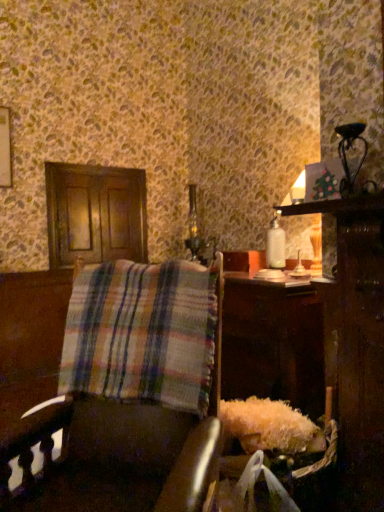
Where is `metallic silver table lamp at upper right`? Image resolution: width=384 pixels, height=512 pixels. metallic silver table lamp at upper right is located at coordinates (348, 150).

This screenshot has height=512, width=384. What do you see at coordinates (142, 334) in the screenshot?
I see `plaid fabric at left` at bounding box center [142, 334].

What is the approximate width of plaid fabric at left?

plaid fabric at left is 10.40 inches in width.

This screenshot has width=384, height=512. In order to click on metallic silver table lamp at upper right in this screenshot , I will do `click(348, 150)`.

From the image's perspective, is metallic silver table lamp at upper right under plaid fabric chair at center?

No, from the image's perspective, metallic silver table lamp at upper right is not beneath plaid fabric chair at center.

From a real-world perspective, relative to plaid fabric chair at center, is metallic silver table lamp at upper right vertically above or below?

Clearly, from a real-world perspective, metallic silver table lamp at upper right is above plaid fabric chair at center.

The image size is (384, 512). I want to click on table lamp behind the plaid fabric chair at center, so click(348, 150).

In the scene shown: Does metallic silver table lamp at upper right turn towards plaid fabric chair at center?

No, metallic silver table lamp at upper right is not facing towards plaid fabric chair at center.

Between plaid fabric at left and metallic silver table lamp at upper right, which one appears on the left side from the viewer's perspective?

plaid fabric at left.

Can you tell me how much plaid fabric at left and metallic silver table lamp at upper right differ in facing direction?

There is a 43.5-degree angle between the facing directions of plaid fabric at left and metallic silver table lamp at upper right.

Does point (129, 338) appear closer or farther from the camera than point (346, 154)?

Clearly, point (129, 338) is closer to the camera than point (346, 154).

Does plaid fabric at left lie behind metallic silver table lamp at upper right?

No.

Looking at this image, considering the relative positions of plaid fabric chair at center and metallic silver table lamp at upper right in the image provided, is plaid fabric chair at center behind metallic silver table lamp at upper right?

That is False.

Considering the points (137, 372) and (360, 161), which point is behind, point (137, 372) or point (360, 161)?

The point (360, 161) is farther from the camera.

From the image's perspective, is plaid fabric chair at center located beneath metallic silver table lamp at upper right?

Indeed, from the image's perspective, plaid fabric chair at center is shown beneath metallic silver table lamp at upper right.

Is metallic silver table lamp at upper right inside or outside of plaid fabric at left?

metallic silver table lamp at upper right cannot be found inside plaid fabric at left.

The width and height of the screenshot is (384, 512). I want to click on table lamp to the right of plaid fabric at left, so click(348, 150).

Can you confirm if metallic silver table lamp at upper right is shorter than plaid fabric at left?

Yes, metallic silver table lamp at upper right is shorter than plaid fabric at left.

Is plaid fabric chair at center wider or thinner than plaid fabric at left?

Considering their sizes, plaid fabric chair at center looks broader than plaid fabric at left.

Between point (146, 270) and point (139, 399), which one is positioned in front?

The point (139, 399) is closer to the camera.

From the picture: From a real-world perspective, which object stands above the other?

plaid fabric at left, from a real-world perspective.

Measure the distance between plaid fabric at left and plaid fabric chair at center.

The distance of plaid fabric at left from plaid fabric chair at center is 6.28 centimeters.

Are plaid fabric at left and plaid fabric chair at center located far from each other?

That's not correct — plaid fabric at left is a little close to plaid fabric chair at center.

Is plaid fabric at left smaller than plaid fabric chair at center?

Correct, plaid fabric at left occupies less space than plaid fabric chair at center.

Could you tell me if plaid fabric at left is turned towards plaid fabric chair at center?

Yes, plaid fabric at left is turned towards plaid fabric chair at center.

Find the location of a particular element. This screenshot has width=384, height=512. furniture that is below the metallic silver table lamp at upper right (from the image's perspective) is located at coordinates (128, 404).

You are a GUI agent. You are given a task and a screenshot of the screen. Output one action in this format:
    pyautogui.click(x=<x>, y=<y>)
    Task: Click on the table lamp above the plaid fabric at left (from a real-world perspective)
    The height and width of the screenshot is (512, 384).
    Given the screenshot: What is the action you would take?
    pyautogui.click(x=348, y=150)

When comparing their distances from plaid fabric at left, does metallic silver table lamp at upper right or plaid fabric chair at center seem further?

metallic silver table lamp at upper right.

Which object lies further to the anchor point metallic silver table lamp at upper right, plaid fabric chair at center or plaid fabric at left?

plaid fabric chair at center is further to metallic silver table lamp at upper right.

Estimate the real-world distances between objects in this image. Which object is further from plaid fabric chair at center, metallic silver table lamp at upper right or plaid fabric at left?

The object further to plaid fabric chair at center is metallic silver table lamp at upper right.

From the picture: Estimate the real-world distances between objects in this image. Which object is further from plaid fabric at left, plaid fabric chair at center or metallic silver table lamp at upper right?

metallic silver table lamp at upper right.

Estimate the real-world distances between objects in this image. Which object is further from metallic silver table lamp at upper right, plaid fabric at left or plaid fabric chair at center?

plaid fabric chair at center lies further to metallic silver table lamp at upper right than the other object.

Which object lies nearer to the anchor point plaid fabric chair at center, plaid fabric at left or metallic silver table lamp at upper right?

Based on the image, plaid fabric at left appears to be nearer to plaid fabric chair at center.

This screenshot has height=512, width=384. What are the coordinates of `plaid between plaid fabric chair at center and metallic silver table lamp at upper right from left to right` in the screenshot? It's located at (142, 334).